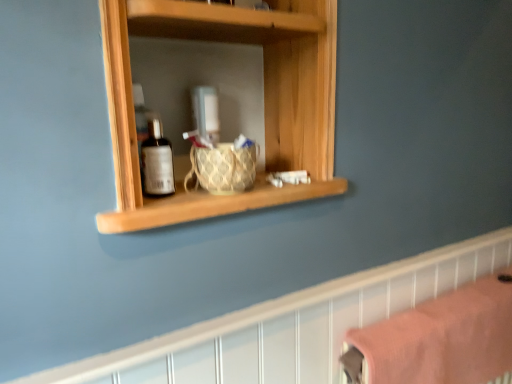
Question: From their relative heights in the image, would you say woven fabric basket at center is taller or shorter than pink fabric towel at lower right?

Choices:
 (A) short
 (B) tall

Answer: (A)

Question: In terms of width, does woven fabric basket at center look wider or thinner when compared to pink fabric towel at lower right?

Choices:
 (A) wide
 (B) thin

Answer: (B)

Question: Which object is positioned closest to the woven fabric basket at center?

Choices:
 (A) pink fabric towel at lower right
 (B) wooden shelf at upper center
 (C) wooden shelf at center

Answer: (C)

Question: Which is farther from the wooden shelf at upper center?

Choices:
 (A) pink fabric towel at lower right
 (B) woven fabric basket at center
 (C) wooden shelf at center

Answer: (C)